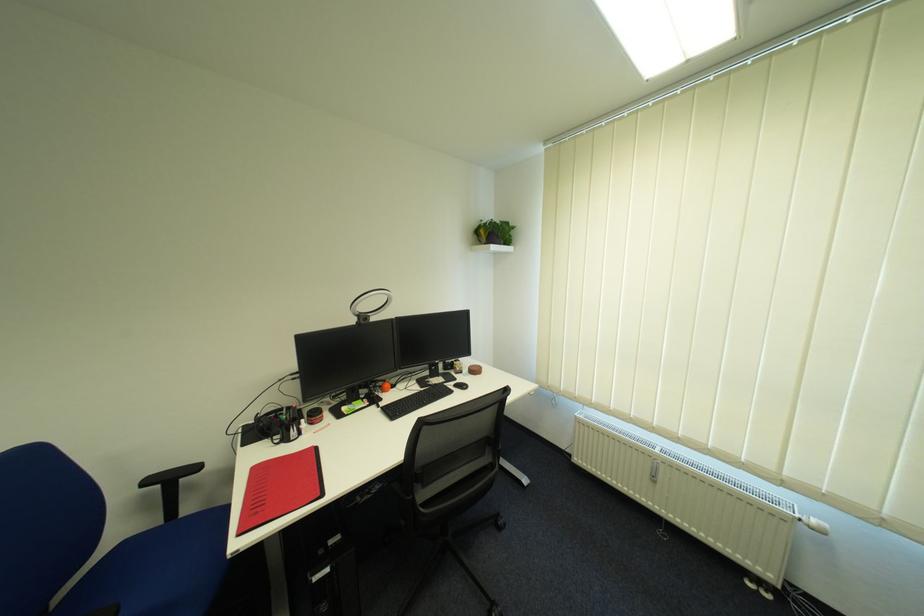
Where would you push the blue chair armrest? Please return your answer as a coordinate pair (x, y).

(169, 485)